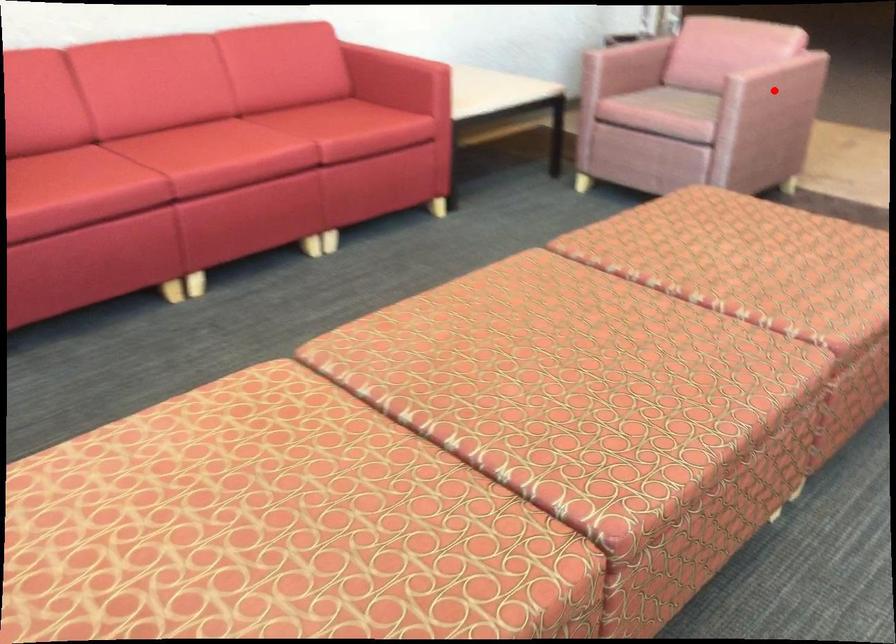
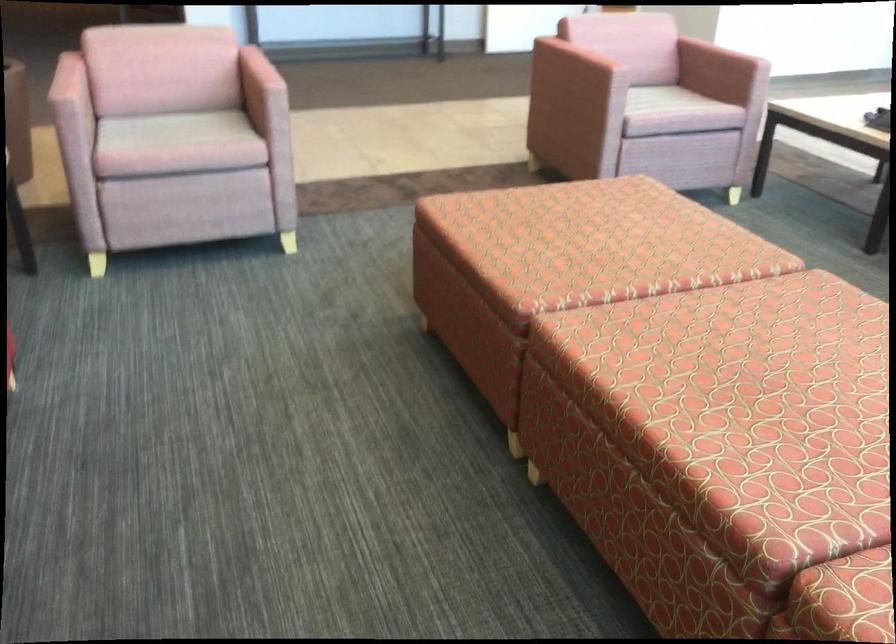
Question: I am providing you with two images of the same scene from different viewpoints. A red point is marked on the first image. At the location where the point appears in image 1, is it still visible in image 2?

Choices:
 (A) Yes
 (B) No

Answer: (B)